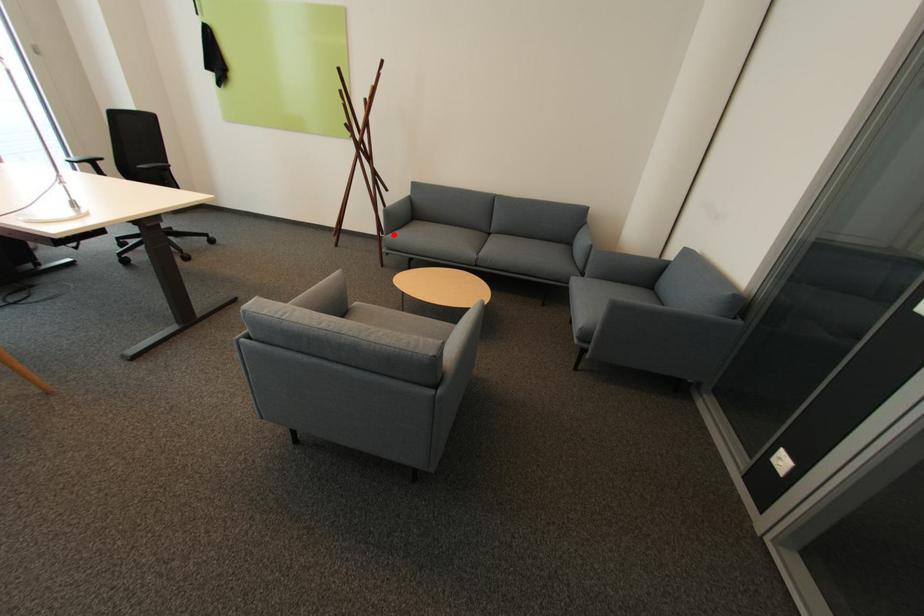
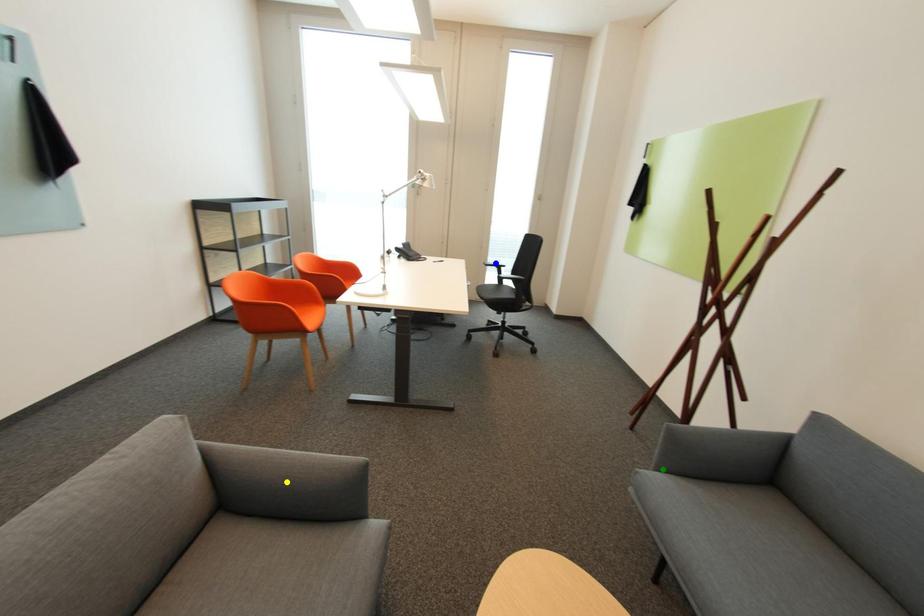
Question: I am providing you with two images of the same scene from different viewpoints. A red point is marked on the first image. You are given multiple points on the second image. Which point in image 2 represents the same 3d spot as the red point in image 1?

Choices:
 (A) green point
 (B) yellow point
 (C) blue point

Answer: (A)